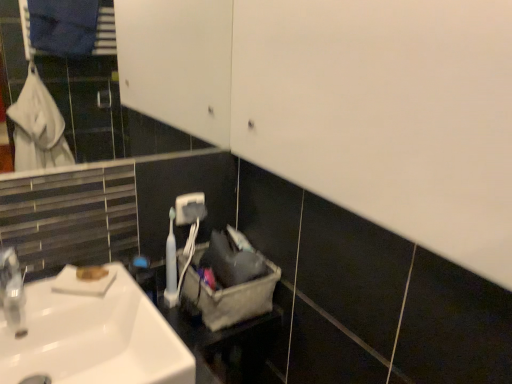
This screenshot has height=384, width=512. Find the location of `free point to the right of white matte soap at lower left`. free point to the right of white matte soap at lower left is located at coordinates pyautogui.click(x=133, y=292).